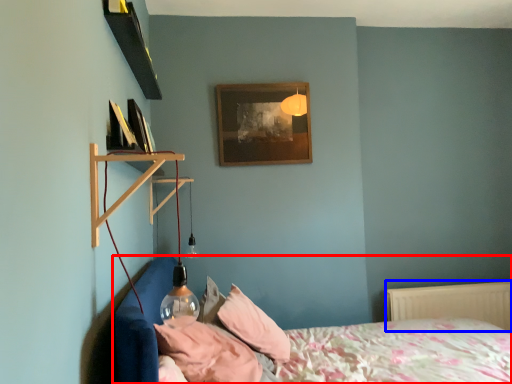
Question: Among these objects, which one is nearest to the camera, bed (highlighted by a red box) or radiator (highlighted by a blue box)?

Choices:
 (A) bed
 (B) radiator

Answer: (A)